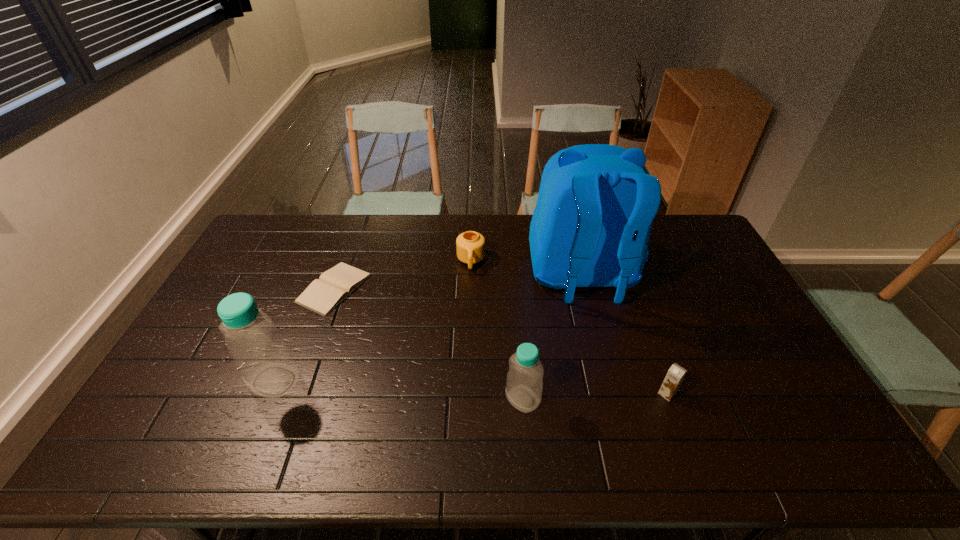
Locate an element on the screen. The image size is (960, 540). blank space at the right edge is located at coordinates (704, 262).

The image size is (960, 540). I want to click on free space at the far left corner of the desktop, so click(276, 245).

I want to click on unoccupied area between the backpack and the second tallest object, so click(x=428, y=328).

Where is `free space between the Bible and the shorter bottle`? free space between the Bible and the shorter bottle is located at coordinates (428, 343).

Identify the location of free spot between the Bible and the left bottle. This screenshot has width=960, height=540. (304, 334).

Image resolution: width=960 pixels, height=540 pixels. I want to click on free space that is in between the chocolate milk and the backpack, so click(x=625, y=334).

At what (x,y) coordinates should I click in order to perform the action: click on free space that is in between the taller bottle and the chocolate milk. Please return your answer as a coordinate pair (x, y). The width and height of the screenshot is (960, 540). Looking at the image, I should click on (470, 387).

I want to click on free spot between the third tallest object and the third object from left to right, so click(x=496, y=330).

This screenshot has width=960, height=540. I want to click on vacant space in between the chocolate milk and the taller bottle, so click(x=470, y=387).

At what (x,y) coordinates should I click in order to perform the action: click on free space between the shortest object and the backpack. Please return your answer as a coordinate pair (x, y). The height and width of the screenshot is (540, 960). Looking at the image, I should click on (458, 282).